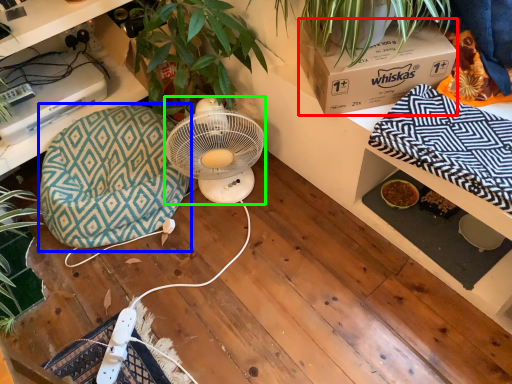
Question: Which is nearer to the box (highlighted by a red box)? bean bag chair (highlighted by a blue box) or mechanical fan (highlighted by a green box).

Choices:
 (A) bean bag chair
 (B) mechanical fan

Answer: (B)